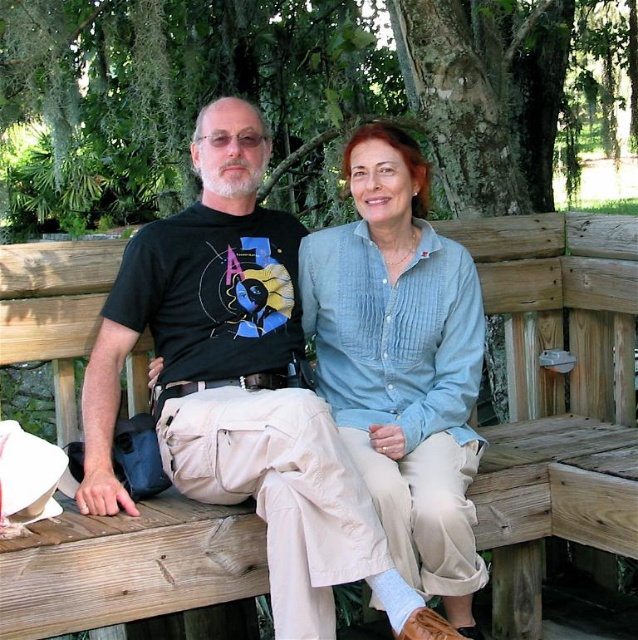
Question: Can you confirm if green mossy tree at upper center is bigger than wooden bench at center?

Choices:
 (A) no
 (B) yes

Answer: (B)

Question: Which object is positioned closest to the light blue cotton shirt at center?

Choices:
 (A) wooden bench at center
 (B) green mossy tree at upper center

Answer: (A)

Question: Among these points, which one is farthest from the camera?

Choices:
 (A) (544, 188)
 (B) (137, 592)
 (C) (338, 232)

Answer: (A)

Question: Which object is the closest to the green mossy tree at upper center?

Choices:
 (A) light blue cotton shirt at center
 (B) wooden bench at center

Answer: (A)

Question: Is wooden bench at center bigger than light blue cotton shirt at center?

Choices:
 (A) yes
 (B) no

Answer: (A)

Question: In this image, where is green mossy tree at upper center located relative to wooden bench at center?

Choices:
 (A) right
 (B) left

Answer: (B)